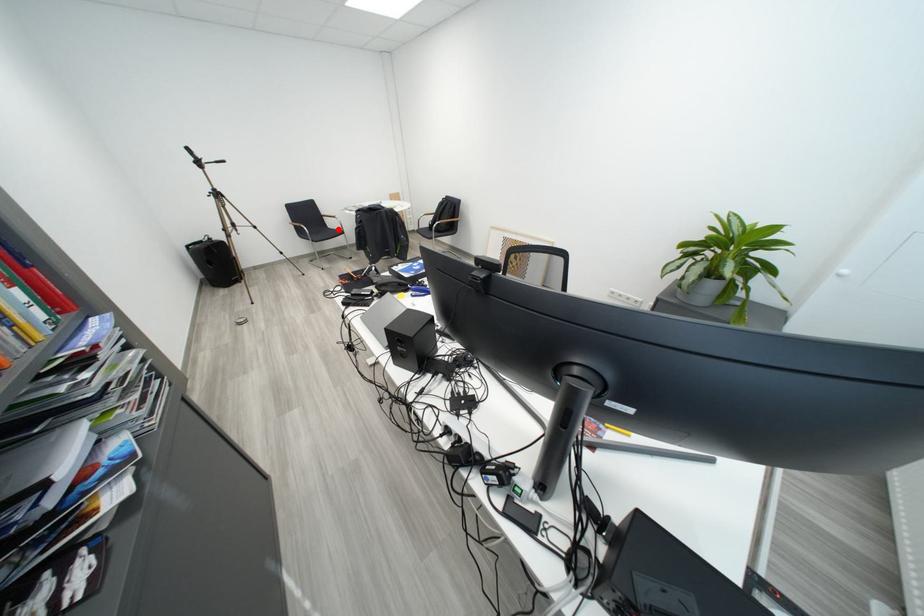
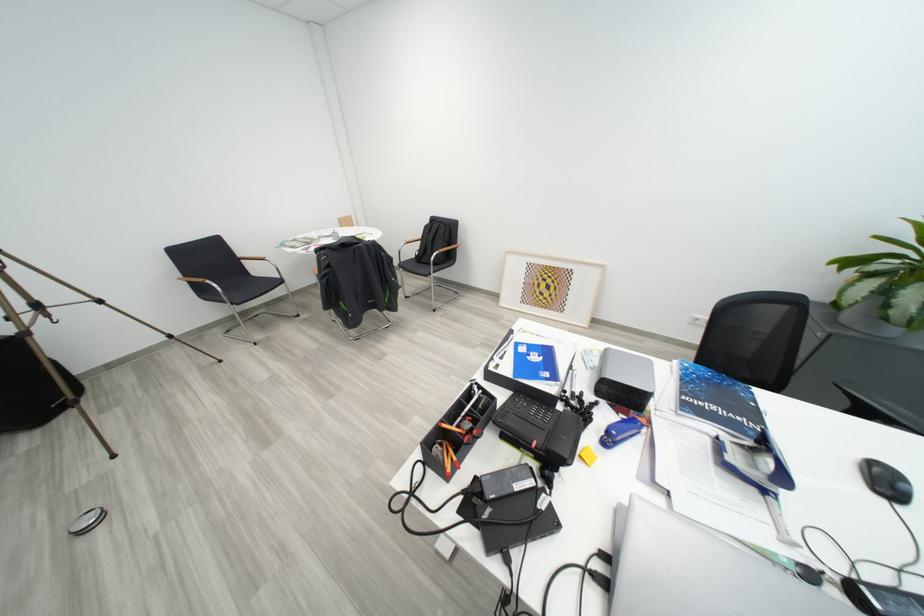
The point at the highlighted location is marked in the first image. Where is the corresponding point in the second image?

(262, 276)